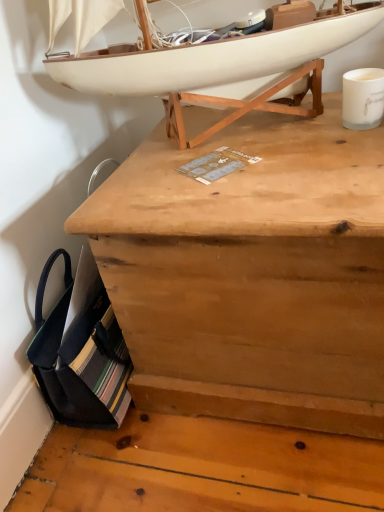
Question: From the image's perspective, is natural wood chest at center on white matte coffee cup at upper right?

Choices:
 (A) no
 (B) yes

Answer: (A)

Question: Does natural wood chest at center have a lesser width compared to white matte coffee cup at upper right?

Choices:
 (A) no
 (B) yes

Answer: (A)

Question: Can you confirm if natural wood chest at center is shorter than white matte coffee cup at upper right?

Choices:
 (A) no
 (B) yes

Answer: (A)

Question: Is the position of natural wood chest at center less distant than that of white matte coffee cup at upper right?

Choices:
 (A) no
 (B) yes

Answer: (B)

Question: From the image's perspective, is natural wood chest at center under white matte coffee cup at upper right?

Choices:
 (A) yes
 (B) no

Answer: (A)

Question: Does point (132, 387) appear closer or farther from the camera than point (268, 78)?

Choices:
 (A) closer
 (B) farther

Answer: (B)

Question: Considering the relative positions of natural wood chest at center and white matte boat at upper center in the image provided, is natural wood chest at center to the left or to the right of white matte boat at upper center?

Choices:
 (A) left
 (B) right

Answer: (B)

Question: Considering the positions of natural wood chest at center and white matte boat at upper center in the image, is natural wood chest at center taller or shorter than white matte boat at upper center?

Choices:
 (A) tall
 (B) short

Answer: (A)

Question: Is natural wood chest at center wider or thinner than white matte boat at upper center?

Choices:
 (A) thin
 (B) wide

Answer: (B)

Question: Looking at their shapes, would you say white matte coffee cup at upper right is wider or thinner than white matte boat at upper center?

Choices:
 (A) wide
 (B) thin

Answer: (B)

Question: Visually, is white matte coffee cup at upper right positioned to the left or to the right of white matte boat at upper center?

Choices:
 (A) right
 (B) left

Answer: (A)

Question: From a real-world perspective, relative to white matte boat at upper center, is white matte coffee cup at upper right vertically above or below?

Choices:
 (A) below
 (B) above

Answer: (A)

Question: Considering the positions of point (352, 74) and point (327, 51), is point (352, 74) closer or farther from the camera than point (327, 51)?

Choices:
 (A) closer
 (B) farther

Answer: (A)

Question: In terms of height, does white matte coffee cup at upper right look taller or shorter compared to natural wood chest at center?

Choices:
 (A) tall
 (B) short

Answer: (B)

Question: Is point (369, 73) positioned closer to the camera than point (291, 212)?

Choices:
 (A) closer
 (B) farther

Answer: (B)